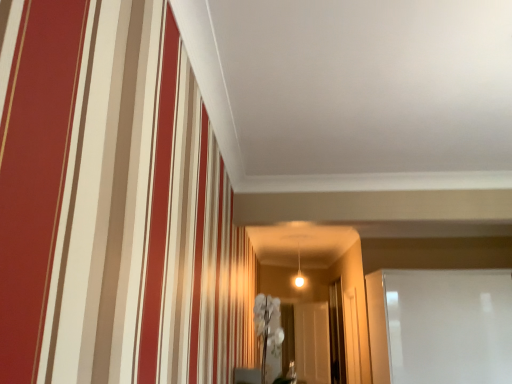
Question: Is the depth of white glossy glass door at right, which appears as the first glass door when viewed from the right, less than that of transparent glass door at center, which appears as the third glass door when viewed from the right?

Choices:
 (A) yes
 (B) no

Answer: (A)

Question: From the image's perspective, does white glossy glass door at right, the third glass door from the left, appear higher than transparent glass door at center, which appears as the first glass door when viewed from the left?

Choices:
 (A) no
 (B) yes

Answer: (B)

Question: Is white glossy glass door at right, the first glass door when ordered from front to back, oriented away from transparent glass door at center, which appears as the first glass door when viewed from the left?

Choices:
 (A) no
 (B) yes

Answer: (B)

Question: Is white glossy glass door at right, which is counted as the third glass door, starting from the back, at the right side of transparent glass door at center, marked as the third glass door in a front-to-back arrangement?

Choices:
 (A) no
 (B) yes

Answer: (B)

Question: From a real-world perspective, is white glossy glass door at right, the first glass door when ordered from front to back, beneath transparent glass door at center, which is the 1th glass door in back-to-front order?

Choices:
 (A) no
 (B) yes

Answer: (A)

Question: Can you confirm if white glossy glass door at right, the first glass door when ordered from front to back, is positioned to the left of transparent glass door at center, marked as the third glass door in a front-to-back arrangement?

Choices:
 (A) yes
 (B) no

Answer: (B)

Question: Is white glossy glass door at right, the first glass door when ordered from front to back, a part of transparent glass door at center, which appears as the first glass door when viewed from the left?

Choices:
 (A) no
 (B) yes

Answer: (A)

Question: From the image's perspective, is transparent glass door at center, which appears as the third glass door when viewed from the right, located beneath white glossy glass door at right, the first glass door when ordered from front to back?

Choices:
 (A) no
 (B) yes

Answer: (B)

Question: From a real-world perspective, is transparent glass door at center, which appears as the third glass door when viewed from the right, positioned over white glossy glass door at right, which appears as the first glass door when viewed from the right, based on gravity?

Choices:
 (A) no
 (B) yes

Answer: (A)

Question: Would you say transparent glass door at center, marked as the third glass door in a front-to-back arrangement, is outside white glossy glass door at right, which appears as the first glass door when viewed from the right?

Choices:
 (A) no
 (B) yes

Answer: (B)

Question: Does transparent glass door at center, which appears as the third glass door when viewed from the right, lie behind white glossy glass door at right, the third glass door from the left?

Choices:
 (A) yes
 (B) no

Answer: (A)

Question: Does transparent glass door at center, which appears as the first glass door when viewed from the left, appear on the right side of white glossy glass door at right, the third glass door from the left?

Choices:
 (A) no
 (B) yes

Answer: (A)

Question: Does white glossy glass door at right, which appears as the first glass door when viewed from the right, have a smaller size compared to transparent glass door at center, the second glass door from the right?

Choices:
 (A) no
 (B) yes

Answer: (A)